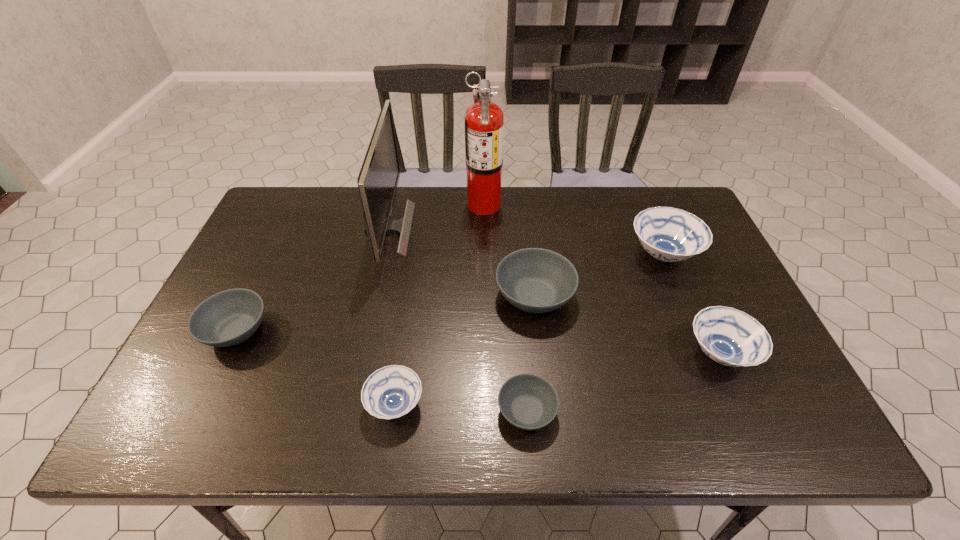
Locate an element on the screen. vacant space that satisfies the following two spatial constraints: 1. on the nozzle side of the fire extinguisher; 2. on the back side of the sixth shortest object is located at coordinates point(485,254).

Locate an element on the screen. The image size is (960, 540). vacant space that satisfies the following two spatial constraints: 1. on the screen side of the leftmost blue soup bowl; 2. on the left side of the monitor is located at coordinates (349, 404).

Locate an element on the screen. Image resolution: width=960 pixels, height=540 pixels. vacant space that satisfies the following two spatial constraints: 1. on the screen side of the monitor; 2. on the right side of the tallest soup bowl is located at coordinates (383, 254).